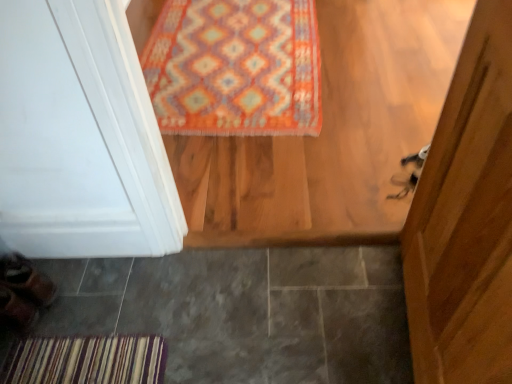
The image size is (512, 384). I want to click on empty space that is ontop of gray tile at lower left (from a real-world perspective), so click(202, 304).